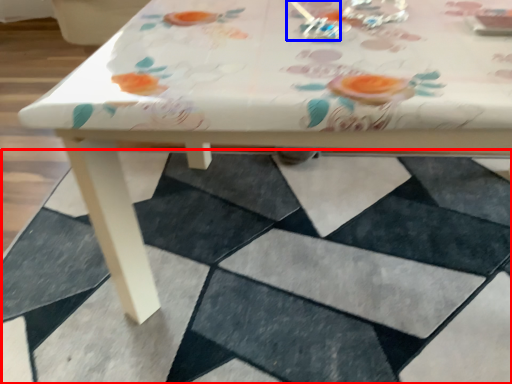
Question: Which point is closer to the camera, square (highlighted by a red box) or tableware (highlighted by a blue box)?

Choices:
 (A) square
 (B) tableware

Answer: (A)